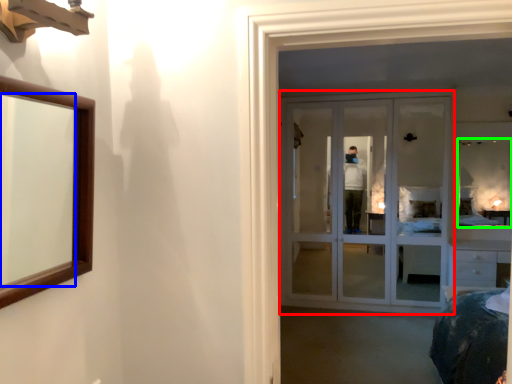
Question: Considering the real-world distances, which object is farthest from door (highlighted by a red box)? mirror (highlighted by a blue box) or mirror (highlighted by a green box)?

Choices:
 (A) mirror
 (B) mirror

Answer: (A)